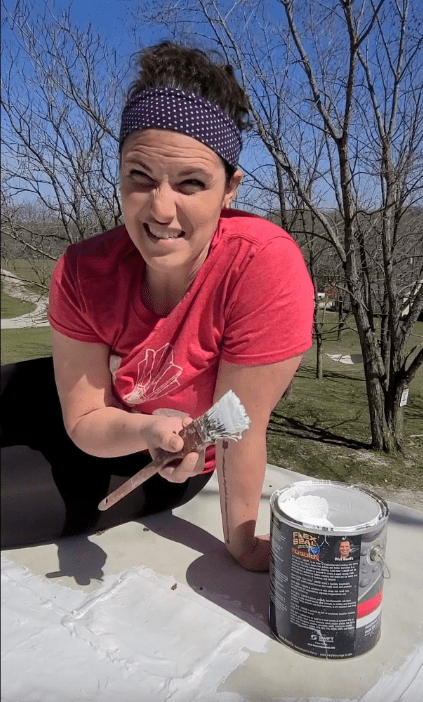
The image size is (423, 702). Find the location of `paint`. paint is located at coordinates (327, 505).